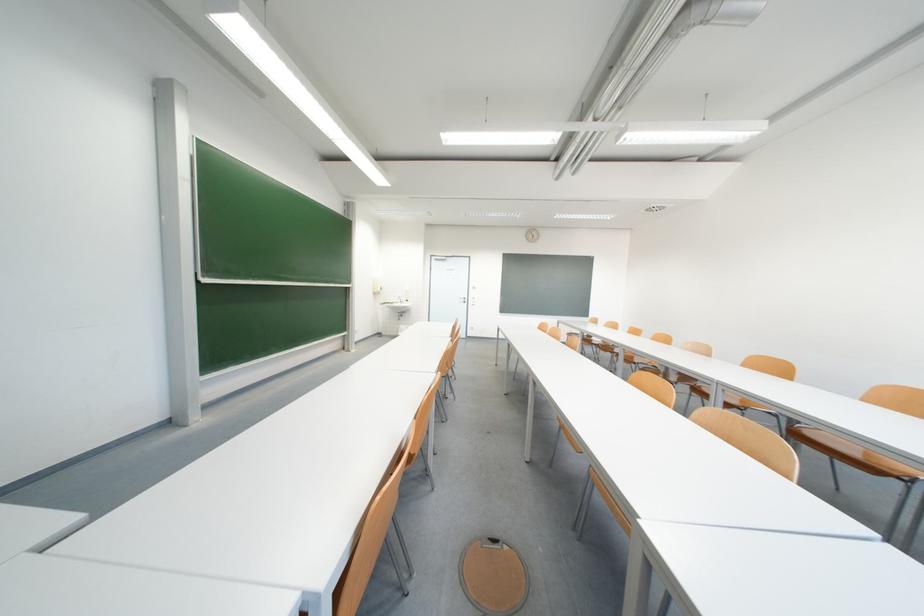
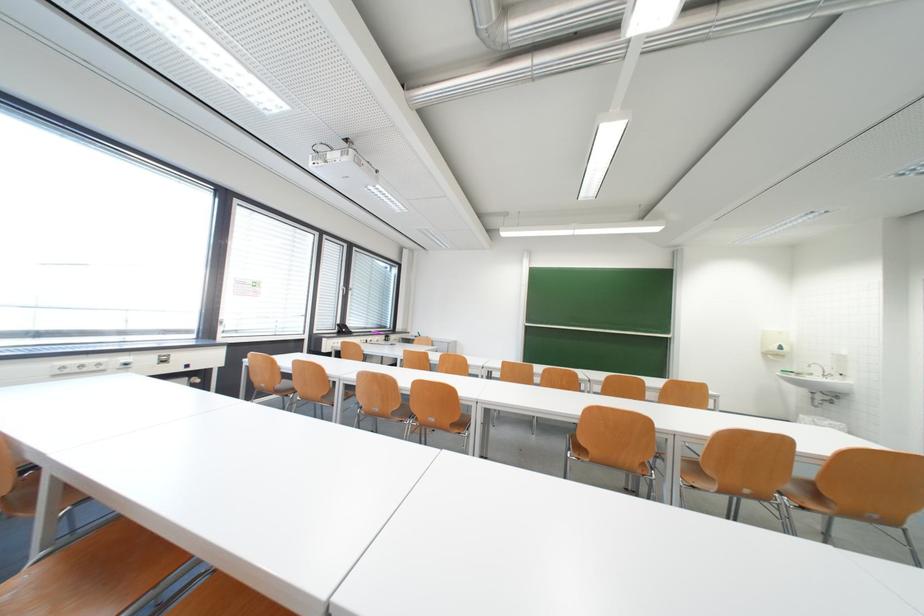
Locate, in the second image, the point that corresponds to point (384, 294) in the first image.

(784, 357)